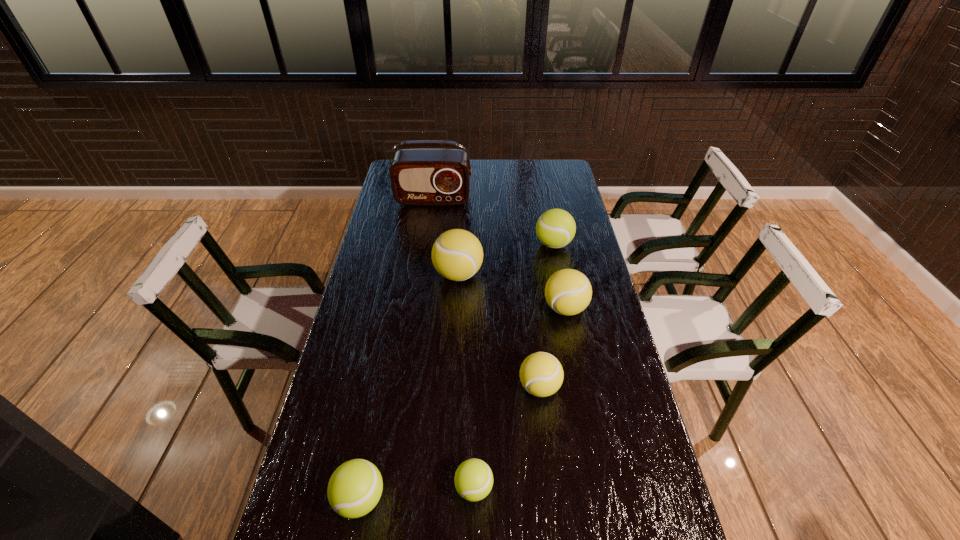
Find the location of a particular element. the farthest object is located at coordinates (425, 177).

In order to click on radio receiver in this screenshot , I will do `click(425, 177)`.

Image resolution: width=960 pixels, height=540 pixels. I want to click on the sixth shortest object, so click(x=457, y=254).

Locate an element on the screen. This screenshot has height=540, width=960. the tallest tennis ball is located at coordinates (457, 254).

Where is `the fourth nearest object`? This screenshot has width=960, height=540. the fourth nearest object is located at coordinates (568, 292).

Where is `the second smallest yellow tennis ball`? the second smallest yellow tennis ball is located at coordinates (568, 292).

At what (x,y) coordinates should I click in order to perform the action: click on the farthest green tennis ball. Please return your answer as a coordinate pair (x, y). The image size is (960, 540). Looking at the image, I should click on (555, 228).

This screenshot has width=960, height=540. What are the coordinates of `the biggest green tennis ball` in the screenshot? It's located at (555, 228).

At what (x,y) coordinates should I click in order to perform the action: click on the third nearest object. Please return your answer as a coordinate pair (x, y). This screenshot has height=540, width=960. Looking at the image, I should click on (541, 374).

At what (x,y) coordinates should I click in order to perform the action: click on the smallest yellow tennis ball. Please return your answer as a coordinate pair (x, y). Image resolution: width=960 pixels, height=540 pixels. Looking at the image, I should click on (541, 374).